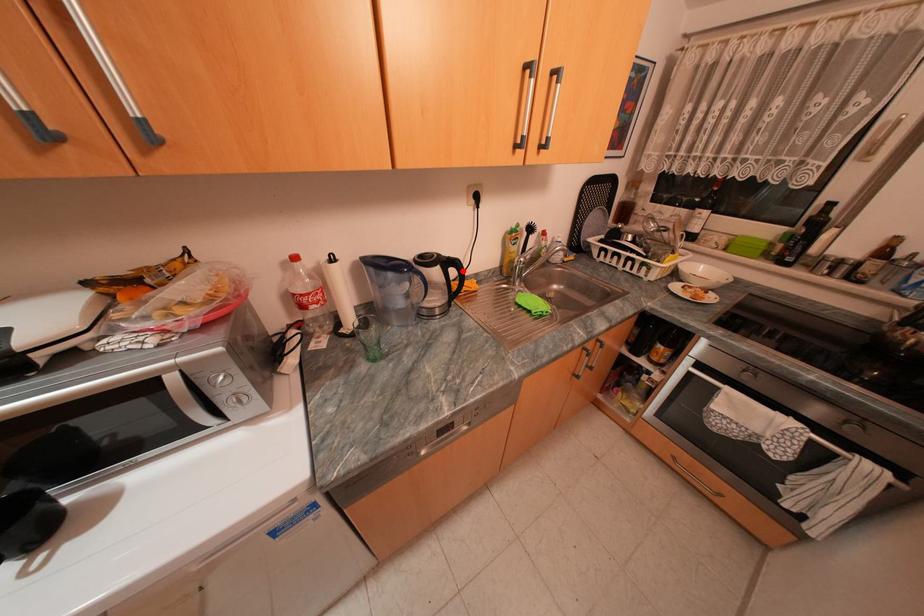
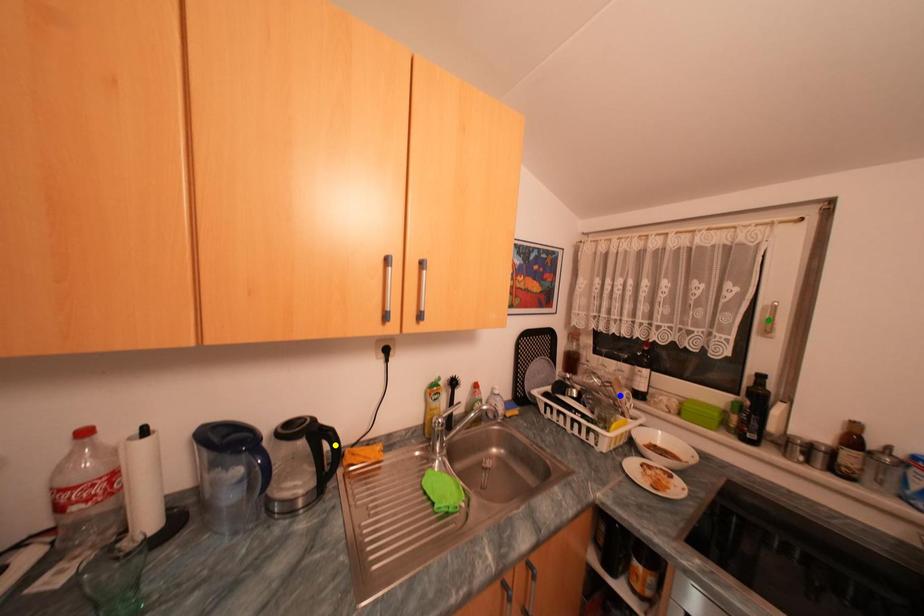
Question: I am providing you with two images of the same scene from different viewpoints. A red point is marked on the first image. You are given multiple points on the second image. Which point in image 2 represents the same 3d spot as the red point in image 1?

Choices:
 (A) yellow point
 (B) blue point
 (C) green point

Answer: (A)